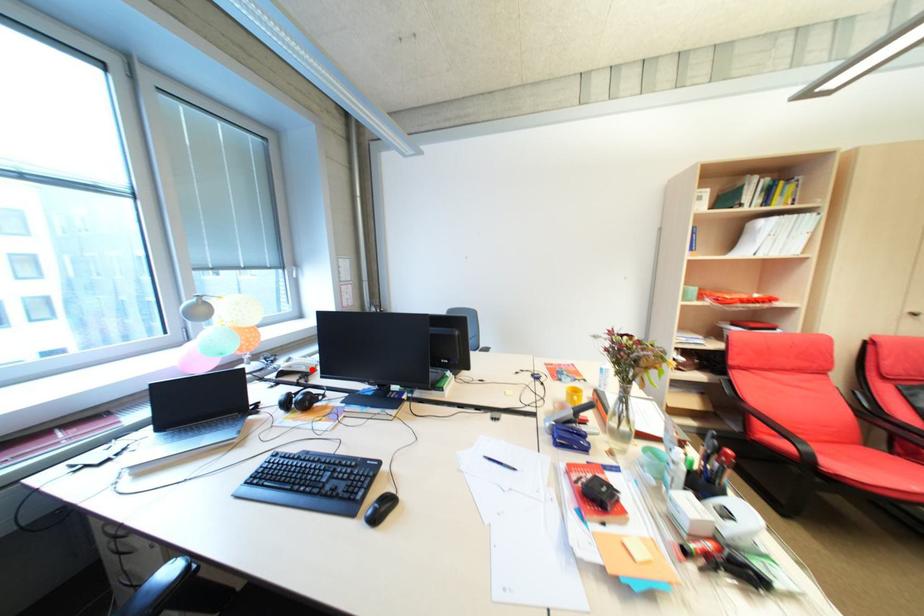
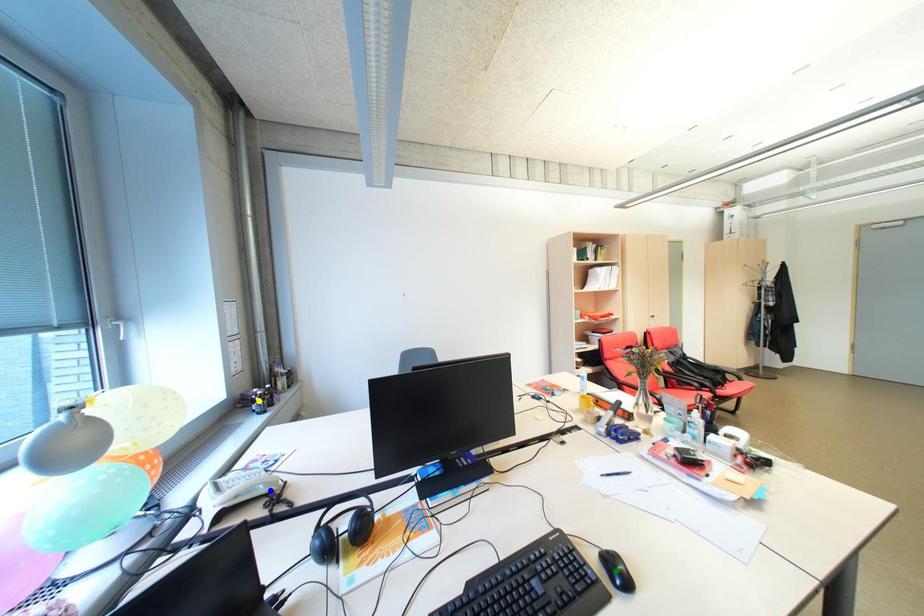
Question: I am providing you with two images of the same scene from different viewpoints. A red point is marked on the first image. You are given multiple points on the second image. In image 2, which mark is for the same physical point as the one in image 1?

Choices:
 (A) yellow point
 (B) blue point
 (C) green point

Answer: (B)